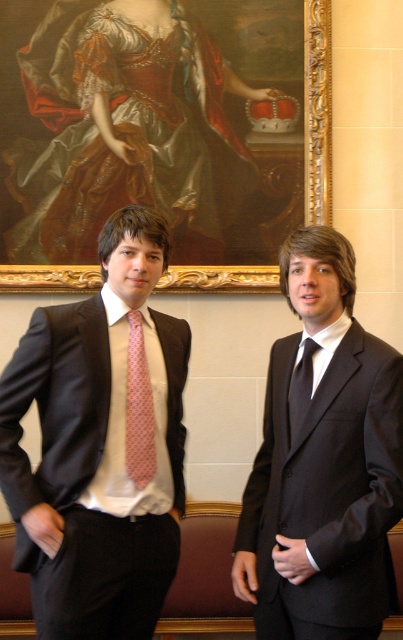
Which is more to the left, pink dotted tie at center or matte pink tie at center?

From the viewer's perspective, pink dotted tie at center appears more on the left side.

Who is higher up, pink dotted tie at center or matte pink tie at center?

Positioned higher is matte pink tie at center.

Identify the location of pink dotted tie at center. (139, 406).

What are the coordinates of `pink dotted tie at center` in the screenshot? It's located at (139, 406).

Locate an element on the screen. gold ornate frame at upper center is located at coordinates (317, 109).

Can you confirm if gold ornate frame at upper center is thinner than pink dotted tie at center?

In fact, gold ornate frame at upper center might be wider than pink dotted tie at center.

This screenshot has width=403, height=640. What do you see at coordinates (317, 109) in the screenshot?
I see `gold ornate frame at upper center` at bounding box center [317, 109].

In order to click on gold ornate frame at upper center in this screenshot , I will do `click(317, 109)`.

What do you see at coordinates (322, 461) in the screenshot? Image resolution: width=403 pixels, height=640 pixels. I see `shiny black suit at center` at bounding box center [322, 461].

At what (x,y) coordinates should I click in order to perform the action: click on shiny black suit at center. Please return your answer as a coordinate pair (x, y). The height and width of the screenshot is (640, 403). Looking at the image, I should click on (322, 461).